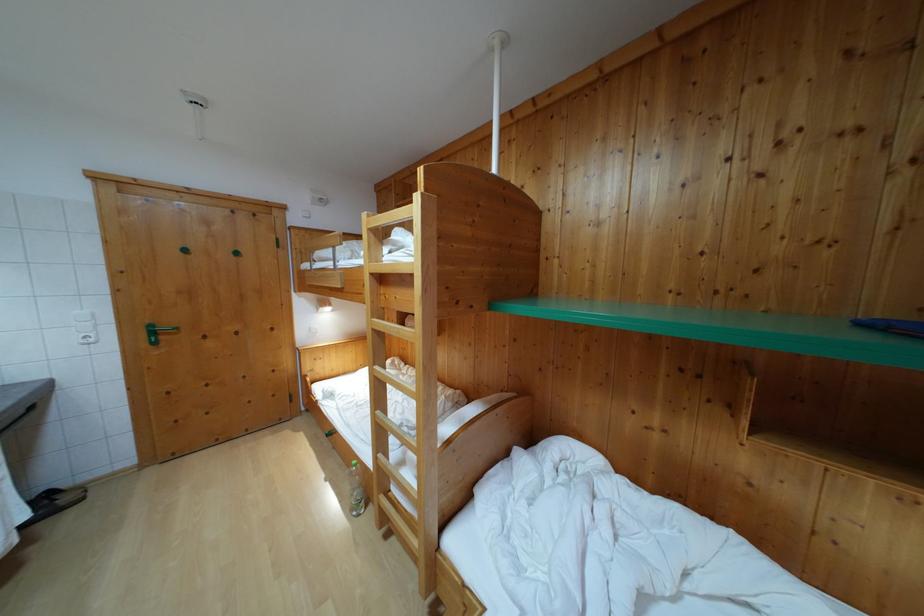
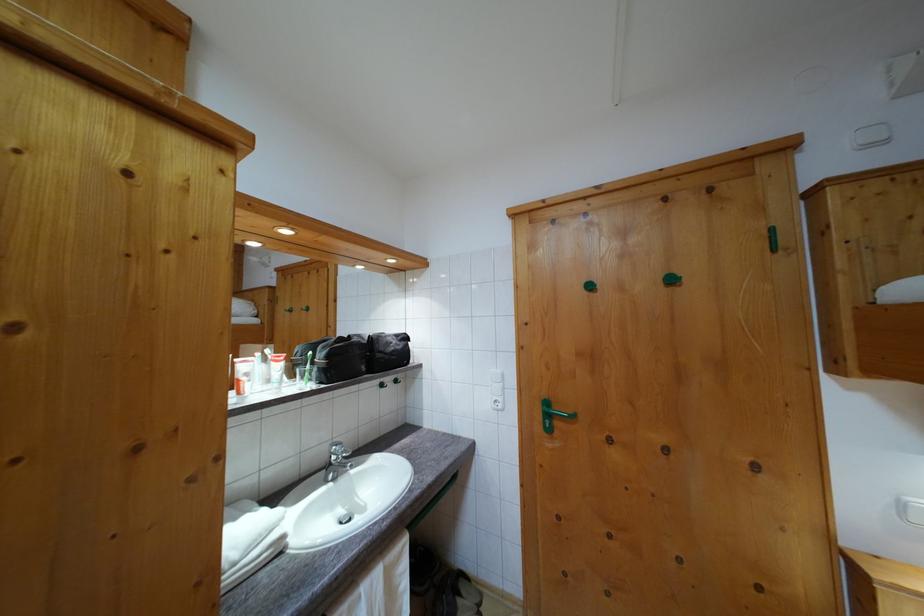
In the second image, find the point that corresponds to (x=157, y=339) in the first image.

(552, 422)